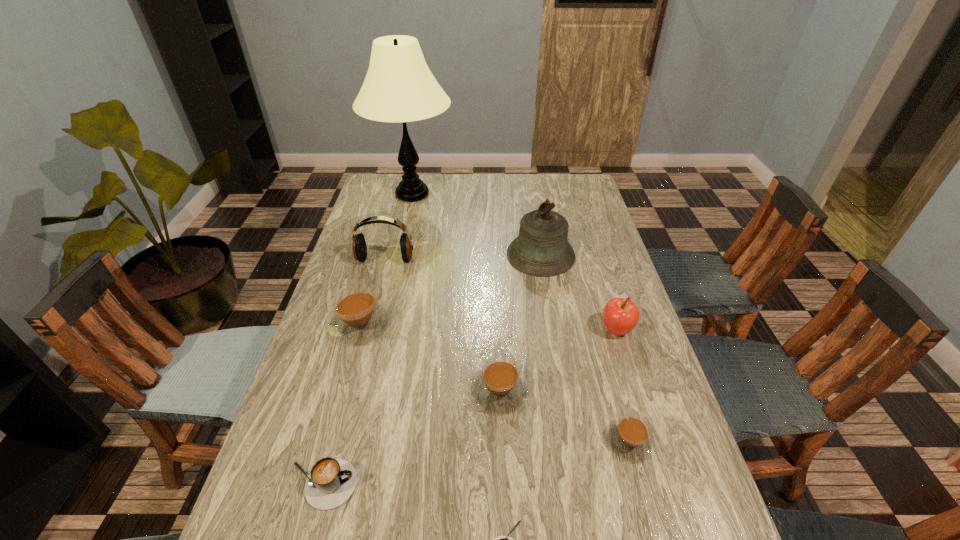
Identify the location of free region at the right edge. (589, 215).

The width and height of the screenshot is (960, 540). In the image, there is a desktop. Find the location of `free space at the far left corner`. free space at the far left corner is located at coordinates (386, 198).

This screenshot has height=540, width=960. In the image, there is a desktop. What are the coordinates of `vacant space at the far right corner` in the screenshot? It's located at click(x=551, y=187).

At what (x,y) coordinates should I click in order to perform the action: click on empty location between the farthest object and the eighth shortest object. Please return your answer as a coordinate pair (x, y). Looking at the image, I should click on tap(476, 225).

You are a GUI agent. You are given a task and a screenshot of the screen. Output one action in this format:
    pyautogui.click(x=<x>, y=<y>)
    Task: Click on the free space that is in between the tallest object and the second tallest object
    The image size is (960, 540).
    Given the screenshot: What is the action you would take?
    pyautogui.click(x=476, y=225)

Where is `vacant point located between the bigger black cappuccino and the apple`? The image size is (960, 540). vacant point located between the bigger black cappuccino and the apple is located at coordinates (469, 407).

Where is `vacant area between the rightmost brown cappuccino and the second brown cappuccino from right to left`? This screenshot has height=540, width=960. vacant area between the rightmost brown cappuccino and the second brown cappuccino from right to left is located at coordinates click(x=564, y=416).

Where is `free spot between the second tallest object and the fourth nearest cappuccino`? The height and width of the screenshot is (540, 960). free spot between the second tallest object and the fourth nearest cappuccino is located at coordinates (520, 322).

At what (x,y) coordinates should I click in order to perform the action: click on vacant point located between the fourth nearest object and the farthest cappuccino. Please return your answer as a coordinate pair (x, y). This screenshot has height=540, width=960. Looking at the image, I should click on (430, 357).

Identify which object is the sixth nearest to the eighth shortest object. Please provide its 2D coordinates. Your answer should be formatted as a tuple, i.e. [(x, y)], where the tuple contains the x and y coordinates of a point satisfying the conditions above.

[(629, 437)]